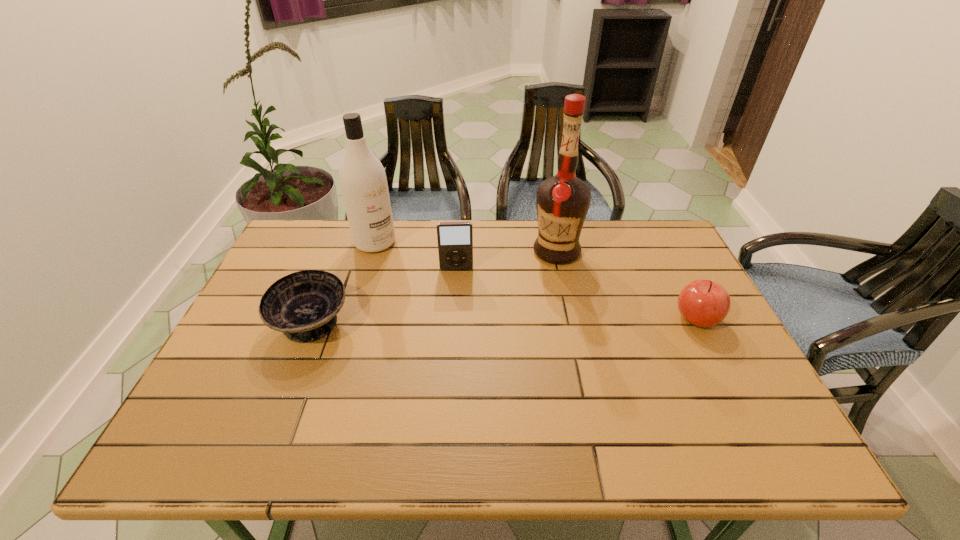
Identify the location of the shortest object. Image resolution: width=960 pixels, height=540 pixels. (303, 305).

I want to click on apple, so click(704, 303).

At what (x,y) coordinates should I click in order to perform the action: click on the second shortest object. Please return your answer as a coordinate pair (x, y). This screenshot has width=960, height=540. Looking at the image, I should click on (704, 303).

Locate an element on the screen. liquor is located at coordinates coord(562,201).

The width and height of the screenshot is (960, 540). Find the location of `shampoo`. shampoo is located at coordinates (363, 182).

The height and width of the screenshot is (540, 960). I want to click on the third shortest object, so click(x=455, y=239).

Locate an element on the screen. The width and height of the screenshot is (960, 540). iPod is located at coordinates [x=455, y=239].

Identify the location of free point located on the left of the bowl. This screenshot has width=960, height=540. (250, 325).

Where is `vacant space located on the left of the apple`? vacant space located on the left of the apple is located at coordinates (553, 318).

Locate an element on the screen. Image resolution: width=960 pixels, height=540 pixels. free location located 0.260m on the front and back of the liquor is located at coordinates (482, 306).